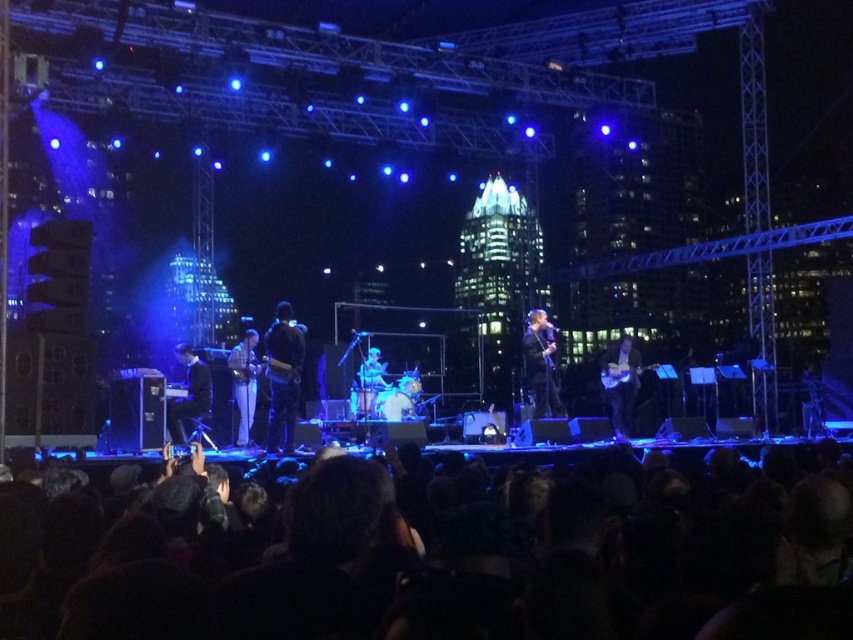
You are a photographer at the concert and need to capture both the dark fabric jacket at center and the shiny black jacket at center in a single frame. Since you want to emphasize the larger jacket, which one should you focus on?

The shiny black jacket at center occupies more space than the dark fabric jacket at center, so you should focus on the shiny black jacket at center to emphasize the larger one.

In the scene shown: You are a photographer at the concert and want to capture a photo that includes both the black fabric crowd at lower center and the matte black guitar at right. Based on their positions, which object should be placed on the left side of the photo?

The black fabric crowd at lower center should be placed on the left side of the photo because it is to the left of the matte black guitar at right.

Based on the photo, you are standing in the audience at the concert venue. There is a point marked at coordinates point (189, 568). Do you think you can reach that point from where you are standing? Please explain your reasoning.

The distance of point (189, 568) from viewer is 226.26 feet. Since the distance is quite large, it would be difficult to reach that point from your current position in the audience without any obstacles, but the exact feasibility depends on the venue layout and any barriers present.